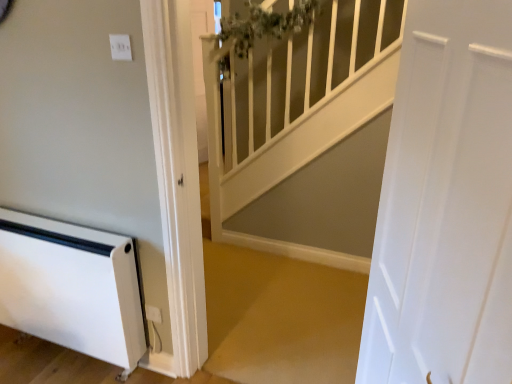
Question: Considering the relative sizes of white smooth door at right and white plastic heater at lower left in the image provided, is white smooth door at right taller than white plastic heater at lower left?

Choices:
 (A) yes
 (B) no

Answer: (A)

Question: From the image's perspective, does white smooth door at right appear higher than white plastic heater at lower left?

Choices:
 (A) yes
 (B) no

Answer: (A)

Question: Is white smooth door at right in front of white plastic heater at lower left?

Choices:
 (A) no
 (B) yes

Answer: (B)

Question: Is white smooth door at right bigger than white plastic heater at lower left?

Choices:
 (A) yes
 (B) no

Answer: (A)

Question: From the image's perspective, would you say white smooth door at right is shown under white plastic heater at lower left?

Choices:
 (A) yes
 (B) no

Answer: (B)

Question: Can white plastic heater at lower left be found inside white smooth door at right?

Choices:
 (A) yes
 (B) no

Answer: (B)

Question: Does white glossy banister at upper center have a larger size compared to white plastic electric outlet at lower center?

Choices:
 (A) yes
 (B) no

Answer: (A)

Question: Is white glossy banister at upper center looking in the opposite direction of white plastic electric outlet at lower center?

Choices:
 (A) yes
 (B) no

Answer: (B)

Question: From the image's perspective, is white glossy banister at upper center under white plastic electric outlet at lower center?

Choices:
 (A) no
 (B) yes

Answer: (A)

Question: Is white glossy banister at upper center positioned beyond the bounds of white plastic electric outlet at lower center?

Choices:
 (A) yes
 (B) no

Answer: (A)

Question: Can you confirm if white glossy banister at upper center is taller than white plastic electric outlet at lower center?

Choices:
 (A) no
 (B) yes

Answer: (B)

Question: Is the position of white glossy banister at upper center less distant than that of white plastic electric outlet at lower center?

Choices:
 (A) no
 (B) yes

Answer: (B)

Question: Considering the relative sizes of white plastic electric outlet at lower center and white glossy banister at upper center in the image provided, is white plastic electric outlet at lower center taller than white glossy banister at upper center?

Choices:
 (A) no
 (B) yes

Answer: (A)